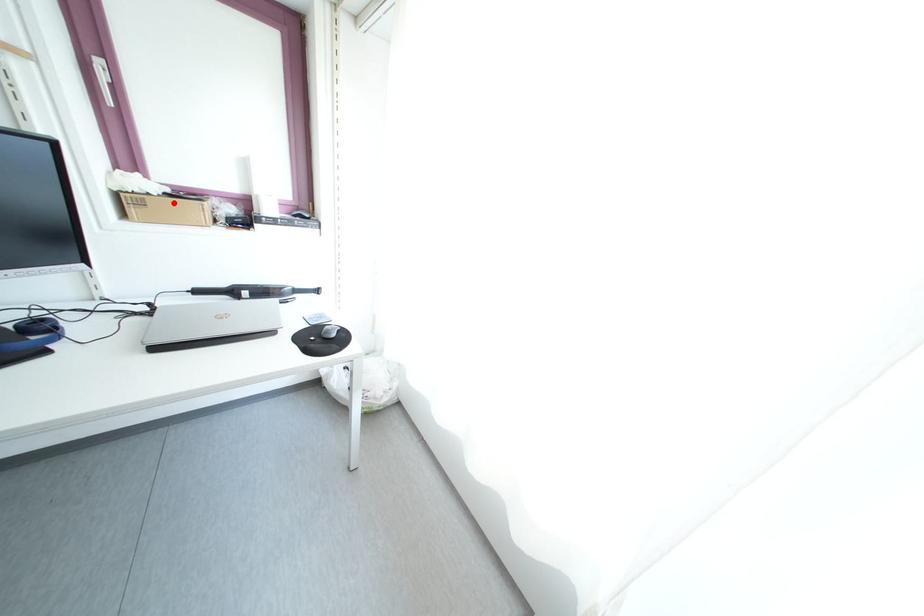
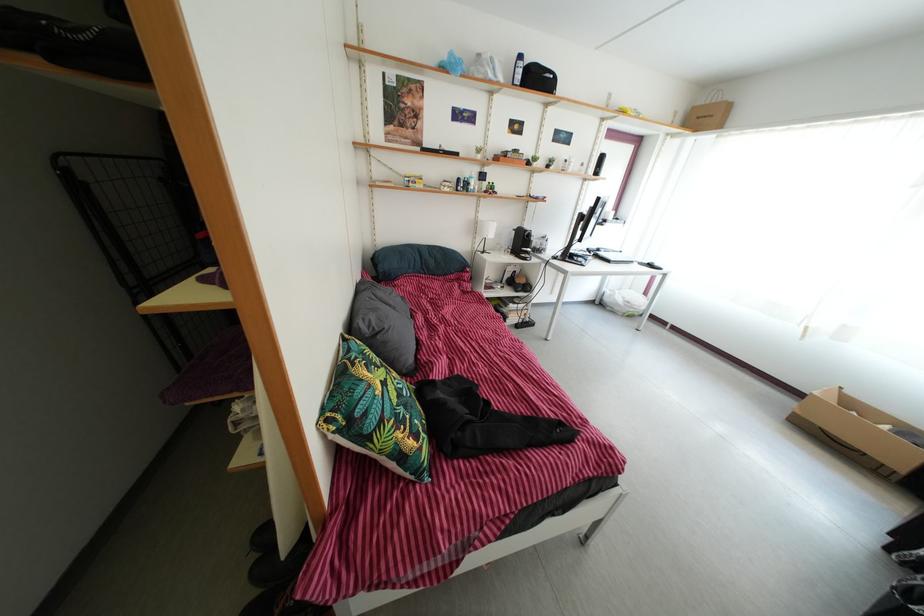
Question: I am providing you with two images of the same scene from different viewpoints. A red point is marked on the first image. Is the red point's position out of view in image 2?

Choices:
 (A) Yes
 (B) No

Answer: (A)